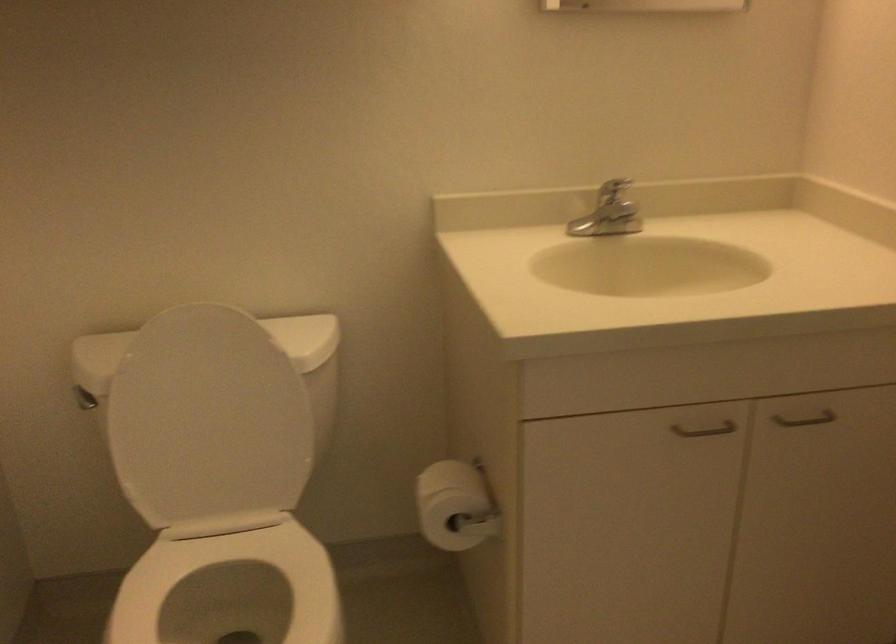
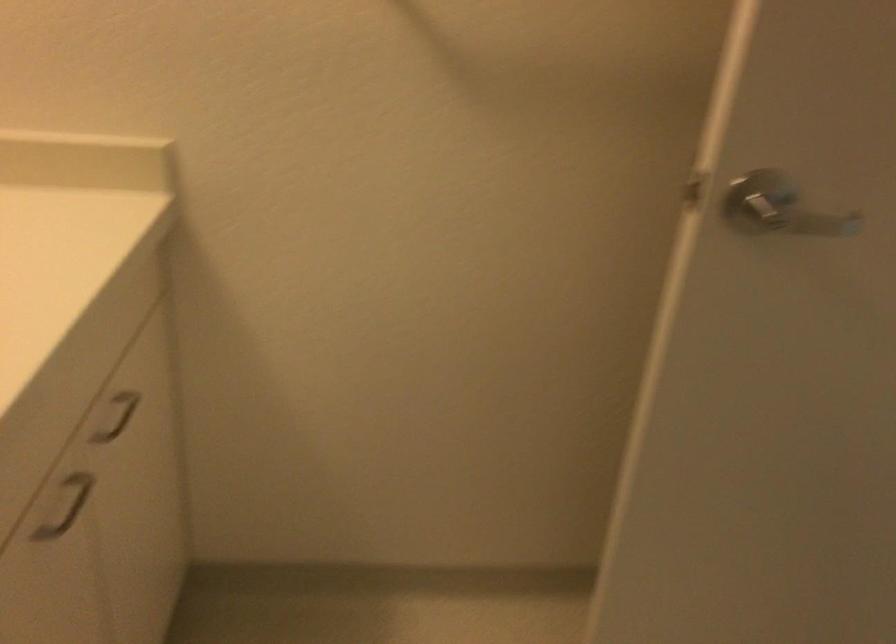
The first image is from the beginning of the video and the second image is from the end. How did the camera likely rotate when shooting the video?

The rotation direction of the camera is right-down.